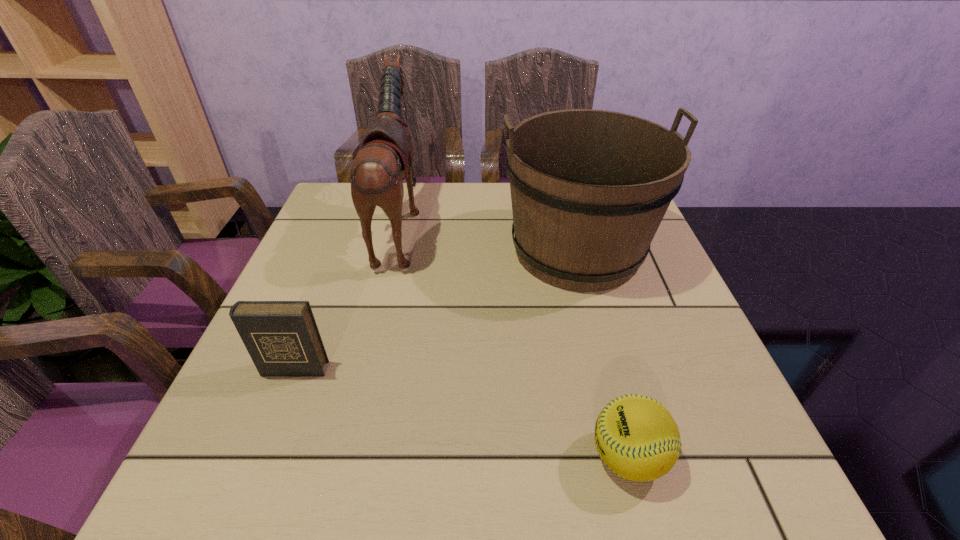
Identify the location of saddle. This screenshot has width=960, height=540. (385, 156).

Find the location of a particular element. bucket is located at coordinates (589, 188).

The height and width of the screenshot is (540, 960). Identify the location of the third tallest object. (282, 338).

Identify the location of the leftmost object. (282, 338).

At what (x,y) coordinates should I click in order to perform the action: click on the shortest object. Please return your answer as a coordinate pair (x, y). The image size is (960, 540). Looking at the image, I should click on (636, 437).

This screenshot has width=960, height=540. Identify the location of softball. (636, 437).

At what (x,y) coordinates should I click in order to perform the action: click on vacant region located 0.220m on the back of the saddle. Please return your answer as a coordinate pair (x, y). The image size is (960, 540). Looking at the image, I should click on (507, 225).

At what (x,y) coordinates should I click in order to perform the action: click on free space located on the front of the bucket. Please return your answer as a coordinate pair (x, y). The height and width of the screenshot is (540, 960). Looking at the image, I should click on (622, 417).

You are a GUI agent. You are given a task and a screenshot of the screen. Output one action in this format:
    pyautogui.click(x=<x>, y=<y>)
    Task: Click on the vacant space located 0.140m on the front cover of the second shortest object
    This screenshot has width=960, height=540.
    Given the screenshot: What is the action you would take?
    pyautogui.click(x=262, y=451)

Where is `vacant space positioned 0.370m on the logo side of the shortest object`? This screenshot has width=960, height=540. vacant space positioned 0.370m on the logo side of the shortest object is located at coordinates (349, 457).